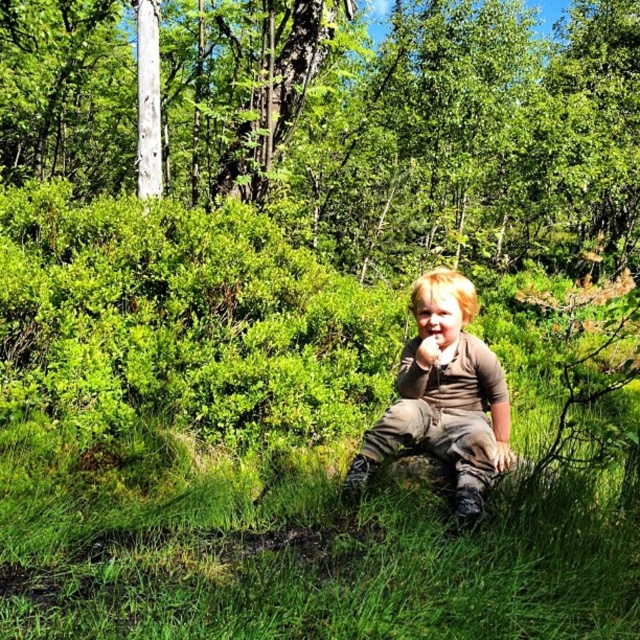
You are a bird flying over the forest scene. You see the green leafy tree at upper center and the brown textured shirt at center. Which object is higher from the ground?

The green leafy tree at upper center is higher from the ground than the brown textured shirt at center because it is positioned above it in the scene.

You are a hiker who wants to take a photo of the green leafy tree at upper center. You are currently standing at point (419, 129). Is the tree in front of you or behind you?

The green leafy tree at upper center is located at point (419, 129), so it is directly in front of you since you are standing at that exact point.